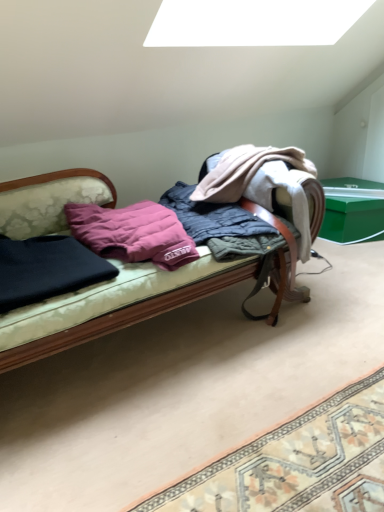
Question: Is velvet-like fabric couch at center turned away from dark blue fabric at left, arranged as the 1th clothing when viewed from the left?

Choices:
 (A) yes
 (B) no

Answer: (A)

Question: Is velvet-like fabric couch at center facing towards dark blue fabric at left, arranged as the 1th clothing when viewed from the left?

Choices:
 (A) yes
 (B) no

Answer: (A)

Question: Considering the relative positions of velvet-like fabric couch at center and dark blue fabric at left, arranged as the 1th clothing when viewed from the left, in the image provided, is velvet-like fabric couch at center to the left of dark blue fabric at left, arranged as the 1th clothing when viewed from the left, from the viewer's perspective?

Choices:
 (A) yes
 (B) no

Answer: (B)

Question: From the image's perspective, is velvet-like fabric couch at center on dark blue fabric at left, arranged as the 1th clothing when viewed from the left?

Choices:
 (A) no
 (B) yes

Answer: (B)

Question: Is velvet-like fabric couch at center at the right side of dark blue fabric at left, arranged as the 1th clothing when viewed from the left?

Choices:
 (A) yes
 (B) no

Answer: (A)

Question: Is velvet-like fabric couch at center outside of dark blue fabric at left, positioned as the second clothing in right-to-left order?

Choices:
 (A) yes
 (B) no

Answer: (A)

Question: Is quilted fabric blanket at center, arranged as the first clothing when viewed from the right, further to the viewer compared to velvet-like fabric couch at center?

Choices:
 (A) yes
 (B) no

Answer: (A)

Question: Is quilted fabric blanket at center, arranged as the first clothing when viewed from the right, located outside velvet-like fabric couch at center?

Choices:
 (A) no
 (B) yes

Answer: (A)

Question: Considering the relative sizes of quilted fabric blanket at center, arranged as the first clothing when viewed from the right, and velvet-like fabric couch at center in the image provided, is quilted fabric blanket at center, arranged as the first clothing when viewed from the right, smaller than velvet-like fabric couch at center?

Choices:
 (A) no
 (B) yes

Answer: (B)

Question: Does quilted fabric blanket at center, arranged as the first clothing when viewed from the right, appear on the left side of velvet-like fabric couch at center?

Choices:
 (A) yes
 (B) no

Answer: (B)

Question: Could you tell me if quilted fabric blanket at center, the second clothing positioned from the left, is facing velvet-like fabric couch at center?

Choices:
 (A) yes
 (B) no

Answer: (A)

Question: Is quilted fabric blanket at center, arranged as the first clothing when viewed from the right, looking in the opposite direction of velvet-like fabric couch at center?

Choices:
 (A) yes
 (B) no

Answer: (A)

Question: Does dark blue fabric at left, positioned as the second clothing in right-to-left order, come behind purple down pillow at center?

Choices:
 (A) yes
 (B) no

Answer: (B)